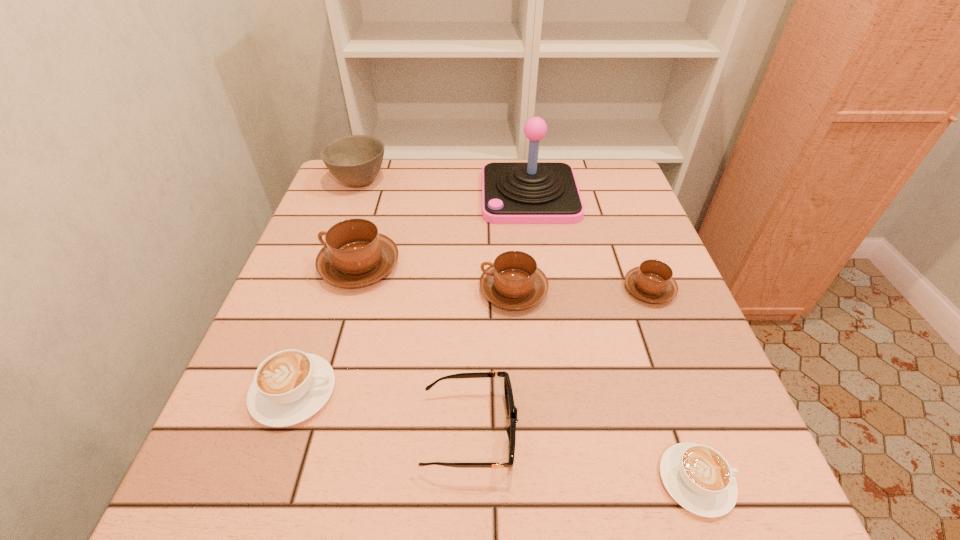
At what (x,y) coordinates should I click in order to perform the action: click on vacant area that satisfies the following two spatial constraints: 1. on the side of the rightmost brown cappuccino with the handle; 2. forward from the base of the tallest object. Please return your answer as a coordinate pair (x, y). Looking at the image, I should click on (613, 195).